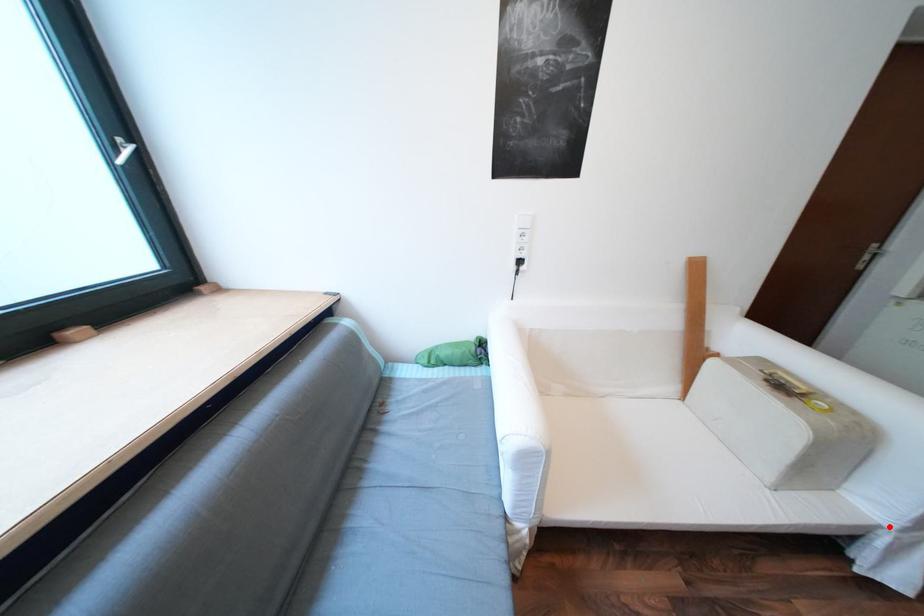
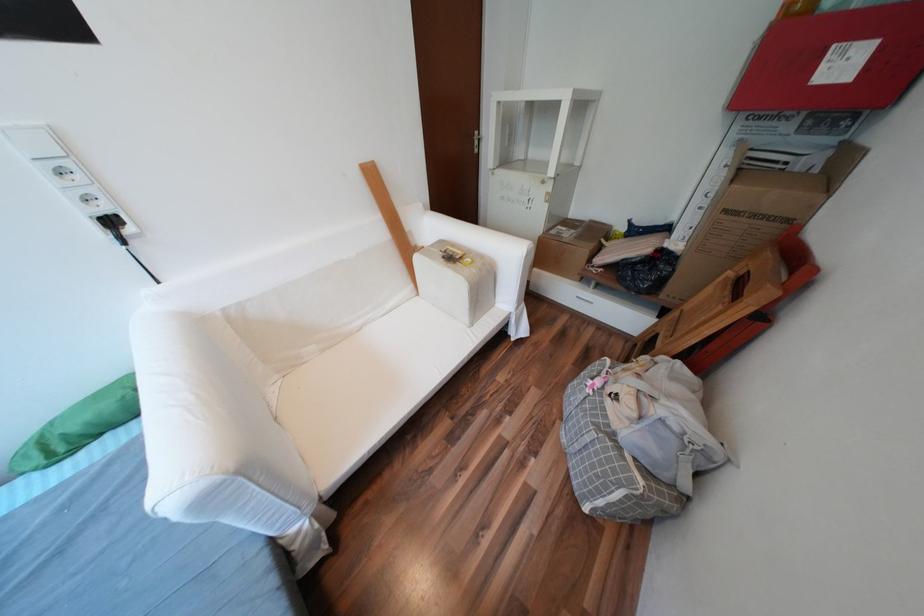
Question: A red point is marked in image1. In image2, is the corresponding 3D point closer to the camera or farther? Reply with the corresponding letter.

Choices:
 (A) The corresponding 3D point is closer.
 (B) The corresponding 3D point is farther.

Answer: (B)